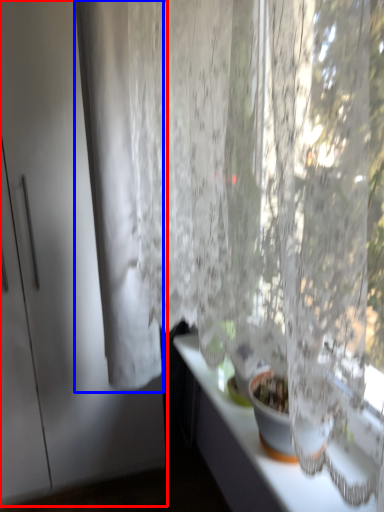
Question: Which of the following is the closest to the observer, screen door (highlighted by a red box) or curtain (highlighted by a blue box)?

Choices:
 (A) screen door
 (B) curtain

Answer: (B)